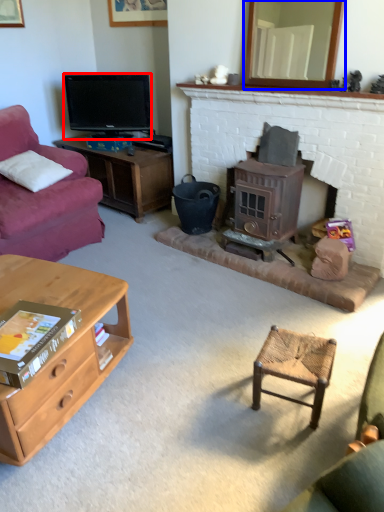
Question: Which of the following is the farthest to the observer, television (highlighted by a red box) or mirror (highlighted by a blue box)?

Choices:
 (A) television
 (B) mirror

Answer: (A)